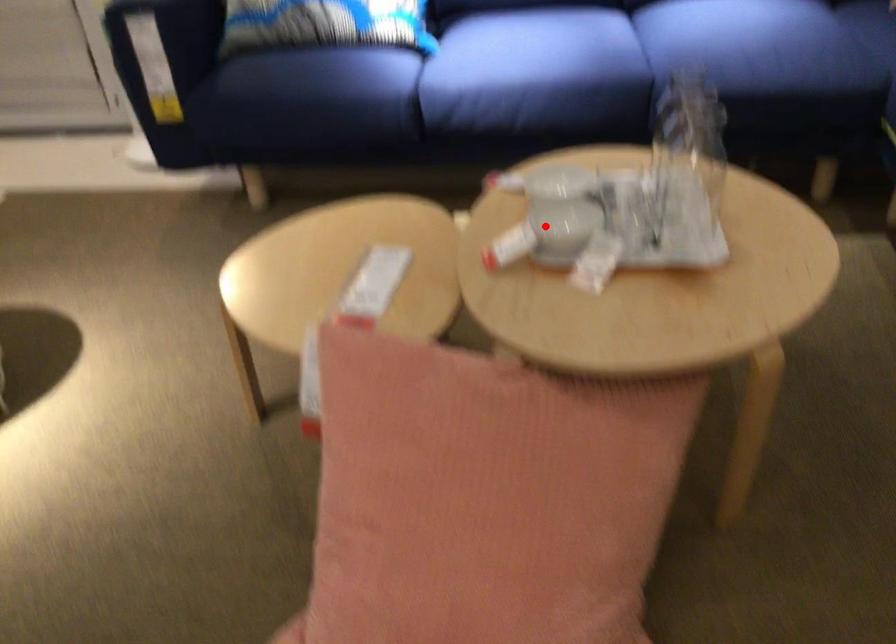
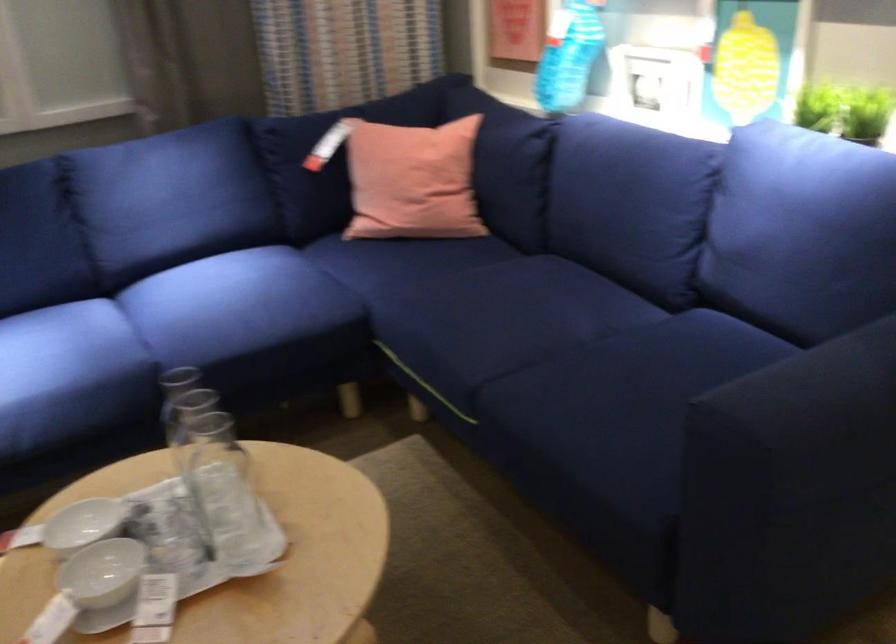
Question: I am providing you with two images of the same scene from different viewpoints. Given a red point in image1, look at the same physical point in image2. Is it:

Choices:
 (A) Closer to the viewpoint
 (B) Farther from the viewpoint

Answer: (A)